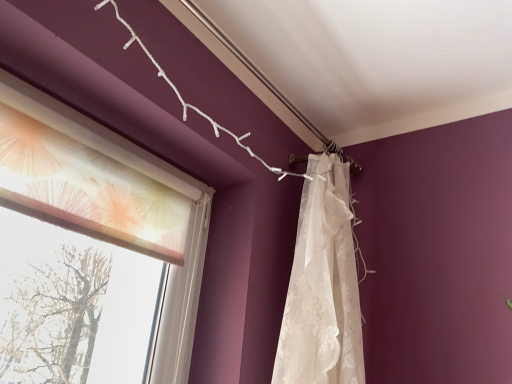
What do you see at coordinates (122, 222) in the screenshot?
I see `translucent fabric at left` at bounding box center [122, 222].

In order to click on translucent fabric at left in this screenshot , I will do `click(122, 222)`.

Describe the element at coordinates (322, 286) in the screenshot. I see `white lace curtain at upper right` at that location.

Image resolution: width=512 pixels, height=384 pixels. What are the coordinates of `white lace curtain at upper right` in the screenshot? It's located at (322, 286).

Find the location of a particular element. translucent fabric at left is located at coordinates (122, 222).

Can you confirm if translucent fabric at left is positioned to the left of white lace curtain at upper right?

Yes, translucent fabric at left is to the left of white lace curtain at upper right.

Considering their positions, is translucent fabric at left located in front of or behind white lace curtain at upper right?

translucent fabric at left is positioned closer to the viewer than white lace curtain at upper right.

Is point (165, 240) farther from viewer compared to point (361, 339)?

Yes, it is behind point (361, 339).

From the image's perspective, between translucent fabric at left and white lace curtain at upper right, who is located below?

From the image's view, white lace curtain at upper right is below.

From a real-world perspective, who is located higher, translucent fabric at left or white lace curtain at upper right?

From a 3D spatial view, translucent fabric at left is above.

Which object is thinner, translucent fabric at left or white lace curtain at upper right?

With smaller width is translucent fabric at left.

Can you confirm if translucent fabric at left is shorter than white lace curtain at upper right?

Correct, translucent fabric at left is not as tall as white lace curtain at upper right.

Based on their sizes in the image, would you say translucent fabric at left is bigger or smaller than white lace curtain at upper right?

Considering their sizes, translucent fabric at left takes up less space than white lace curtain at upper right.

Is translucent fabric at left inside the boundaries of white lace curtain at upper right, or outside?

translucent fabric at left cannot be found inside white lace curtain at upper right.

Can you see translucent fabric at left touching white lace curtain at upper right?

No, translucent fabric at left is not next to white lace curtain at upper right.

Is translucent fabric at left aimed at white lace curtain at upper right?

No, translucent fabric at left is not facing towards white lace curtain at upper right.

How many degrees apart are the facing directions of translucent fabric at left and white lace curtain at upper right?

0.9 degrees.

Identify the location of curtain on the right of the translucent fabric at left. (322, 286).

Visually, is white lace curtain at upper right positioned to the left or to the right of translucent fabric at left?

white lace curtain at upper right is to the right of translucent fabric at left.

Which object is further away from the camera taking this photo, white lace curtain at upper right or translucent fabric at left?

white lace curtain at upper right is further away from the camera.

Does point (324, 288) come behind point (182, 239)?

That is False.

From the image's perspective, which one is positioned lower, white lace curtain at upper right or translucent fabric at left?

white lace curtain at upper right.

From a real-world perspective, is white lace curtain at upper right physically above translucent fabric at left?

No.

Does white lace curtain at upper right have a greater width compared to translucent fabric at left?

Yes, white lace curtain at upper right is wider than translucent fabric at left.

In terms of height, does white lace curtain at upper right look taller or shorter compared to translucent fabric at left?

Clearly, white lace curtain at upper right is taller compared to translucent fabric at left.

Who is bigger, white lace curtain at upper right or translucent fabric at left?

white lace curtain at upper right is bigger.

Is white lace curtain at upper right spatially inside translucent fabric at left, or outside of it?

The correct answer is: outside.

Is white lace curtain at upper right touching translucent fabric at left?

They are not placed beside each other.

Is white lace curtain at upper right looking in the opposite direction of translucent fabric at left?

No, white lace curtain at upper right is not facing away from translucent fabric at left.

How different are the orientations of white lace curtain at upper right and translucent fabric at left in degrees?

The facing directions of white lace curtain at upper right and translucent fabric at left are 0.9 degrees apart.

At what (x,y) coordinates should I click in order to perform the action: click on window that is on the left side of white lace curtain at upper right. Please return your answer as a coordinate pair (x, y). This screenshot has width=512, height=384. Looking at the image, I should click on (122, 222).

The height and width of the screenshot is (384, 512). Identify the location of window above the white lace curtain at upper right (from a real-world perspective). (122, 222).

Locate an element on the screen. The image size is (512, 384). window in front of the white lace curtain at upper right is located at coordinates (122, 222).